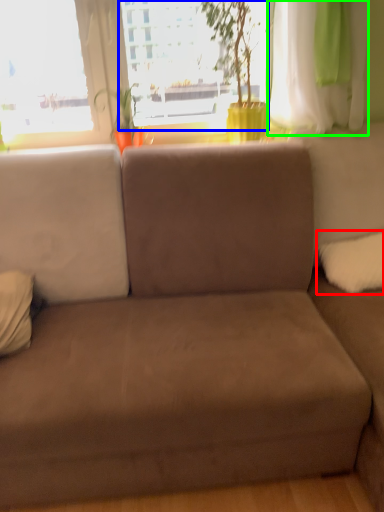
Question: Which object is positioned closest to pillow (highlighted by a red box)? Select from window screen (highlighted by a blue box) and curtain (highlighted by a green box).

Choices:
 (A) window screen
 (B) curtain

Answer: (B)